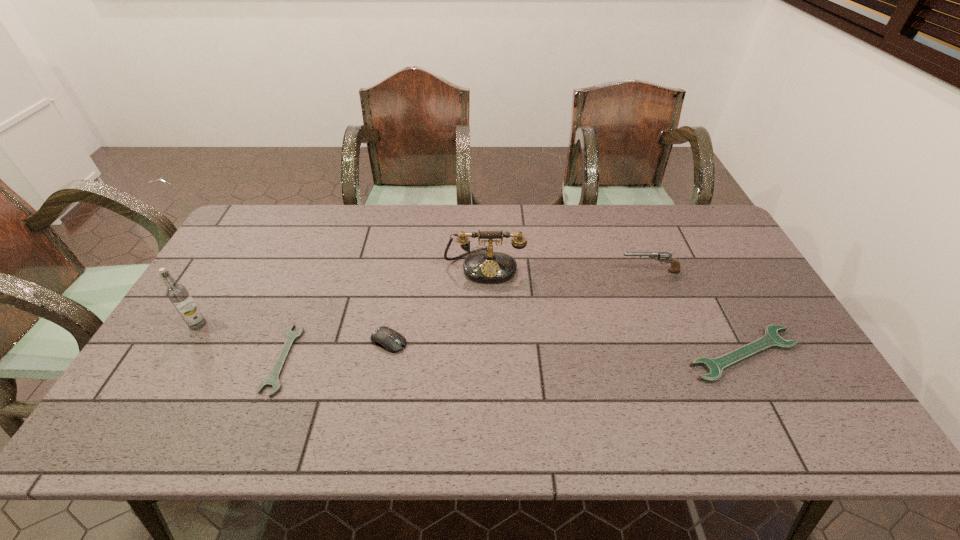
Identify the location of the shortest object. (273, 380).

Where is `the shorter wrench`? the shorter wrench is located at coordinates coord(273,380).

Where is `the taller wrench`? the taller wrench is located at coordinates (771, 339).

Identify the location of the right wrench. (771, 339).

This screenshot has width=960, height=540. What are the coordinates of `the third object from right to left` in the screenshot? It's located at (484, 267).

Identify the location of the second tallest object. (484, 267).

Where is `gun`? The height and width of the screenshot is (540, 960). gun is located at coordinates (675, 267).

The height and width of the screenshot is (540, 960). What are the coordinates of `the leftmost object` in the screenshot? It's located at (177, 293).

Locate an element on the screen. the tallest object is located at coordinates (177, 293).

Find the location of a particular element. the fourth tallest object is located at coordinates (390, 340).